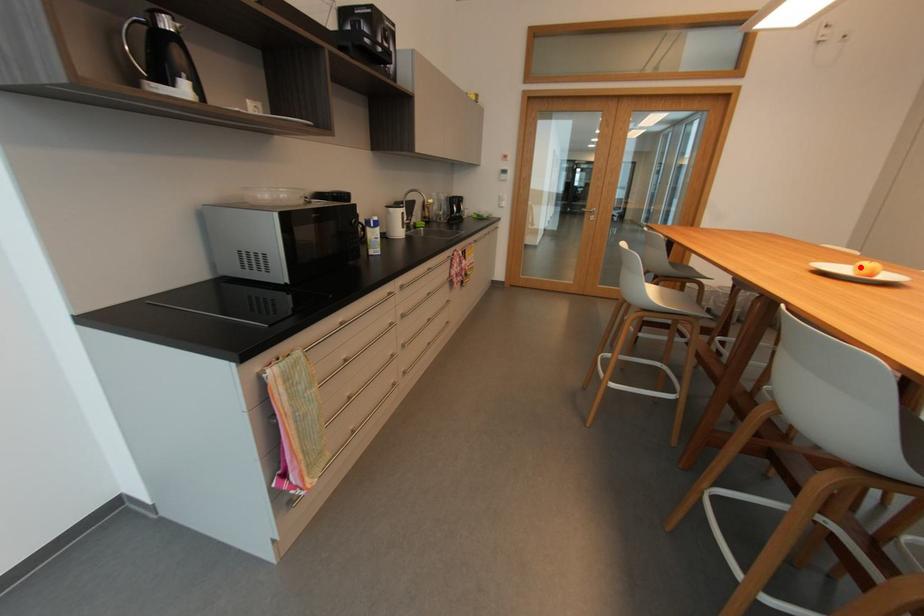
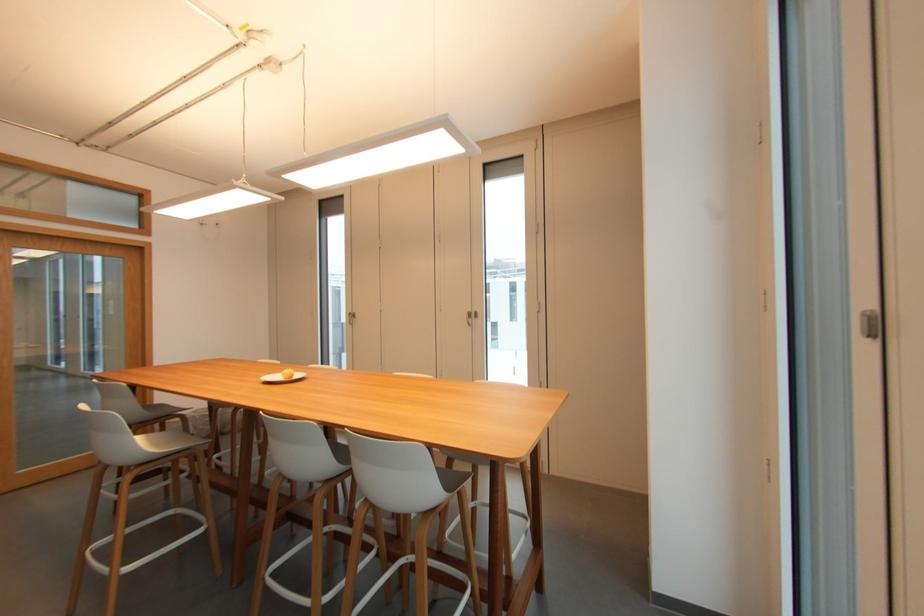
Find the pixel in the second image that matches the highlighted location in the first image.

(287, 375)